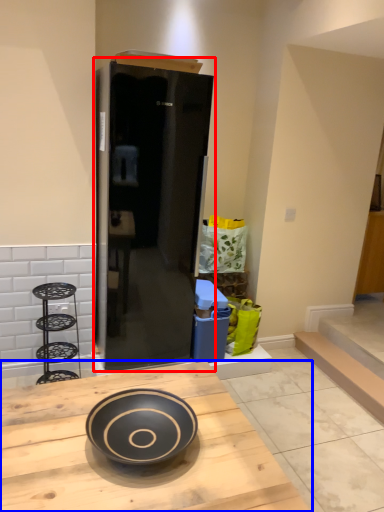
Question: Which of the following is the closest to the observer, door (highlighted by a red box) or kitchen & dining room table (highlighted by a blue box)?

Choices:
 (A) door
 (B) kitchen & dining room table

Answer: (B)